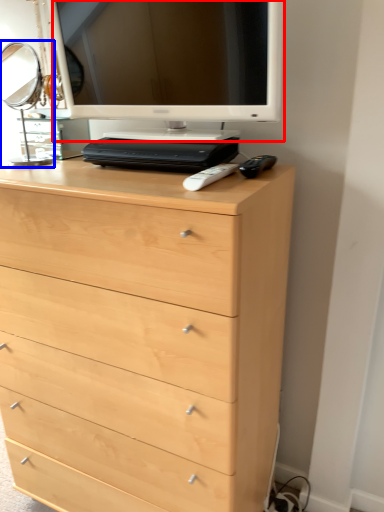
Question: Among these objects, which one is farthest to the camera, computer monitor (highlighted by a red box) or table lamp (highlighted by a blue box)?

Choices:
 (A) computer monitor
 (B) table lamp

Answer: (B)